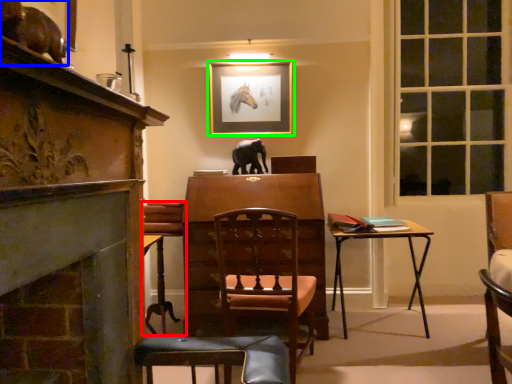
Question: Which object is the closest to the chair (highlighted by a red box)? Choose among these: animal (highlighted by a blue box) or picture frame (highlighted by a green box).

Choices:
 (A) animal
 (B) picture frame

Answer: (B)